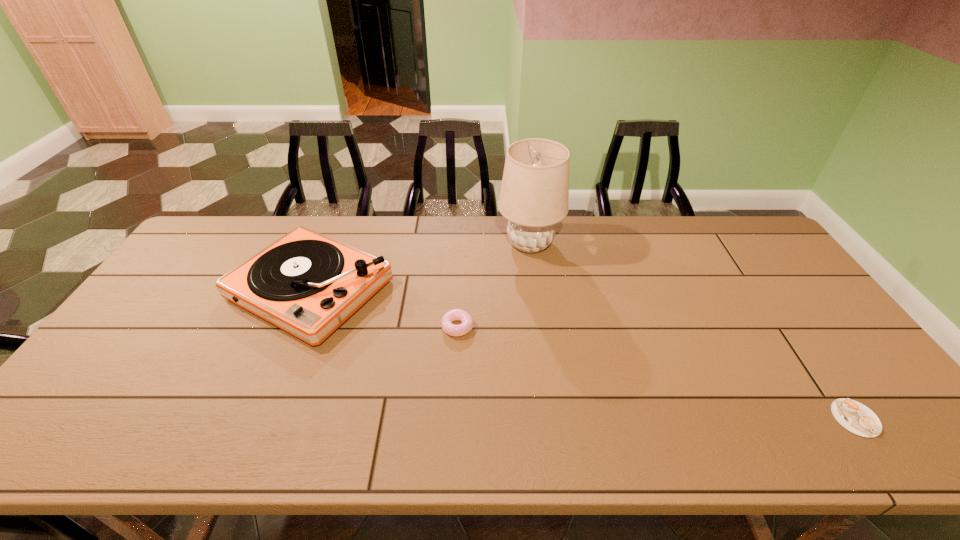
The image size is (960, 540). What are the coordinates of `vacant area that lies between the second tallest object and the second object from left to right` in the screenshot? It's located at (384, 308).

The width and height of the screenshot is (960, 540). What are the coordinates of `free space between the doughnut and the shortest object` in the screenshot? It's located at pos(657,373).

This screenshot has height=540, width=960. Identify the location of object identified as the second closest to the record player. (534, 195).

In order to click on object that is the closest to the leftmost object in this screenshot , I will do `click(467, 321)`.

Locate an element on the screen. This screenshot has height=540, width=960. free space that satisfies the following two spatial constraints: 1. on the front side of the record player; 2. on the left side of the second shortest object is located at coordinates (295, 327).